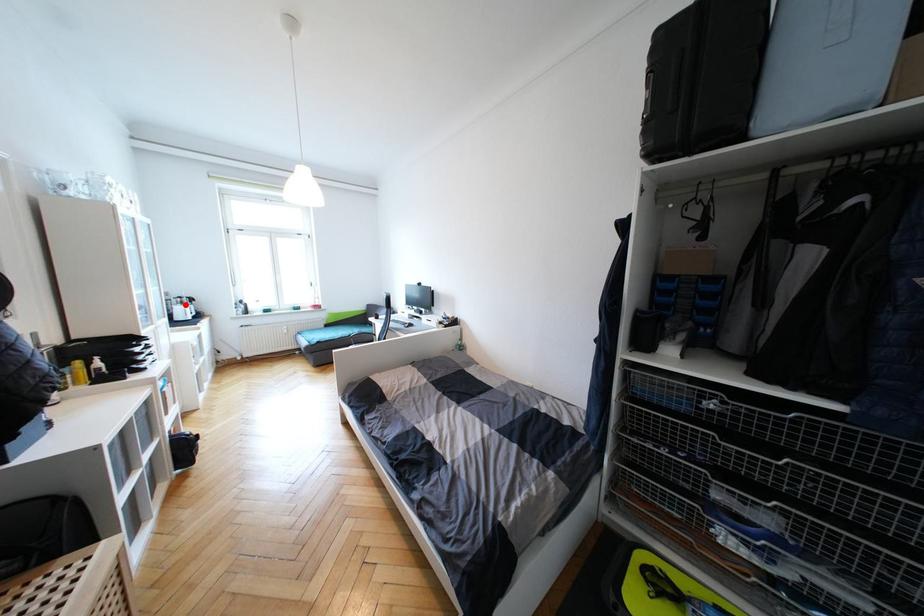
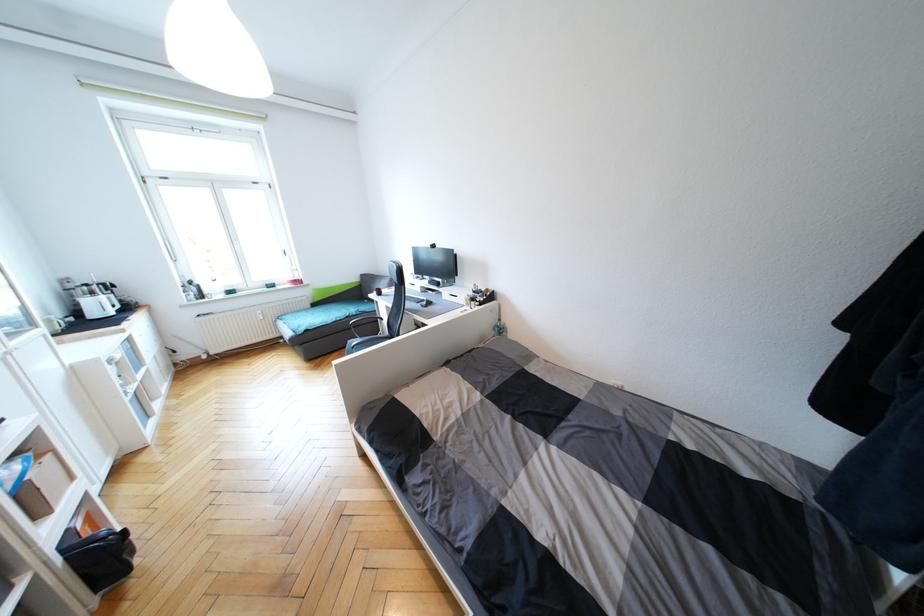
Question: I am providing you with two images of the same scene from different viewpoints. Image1 has a red point marked. In image2, the corresponding 3D location appears at what relative position? Reply with the corresponding letter.

Choices:
 (A) Closer
 (B) Farther

Answer: (B)